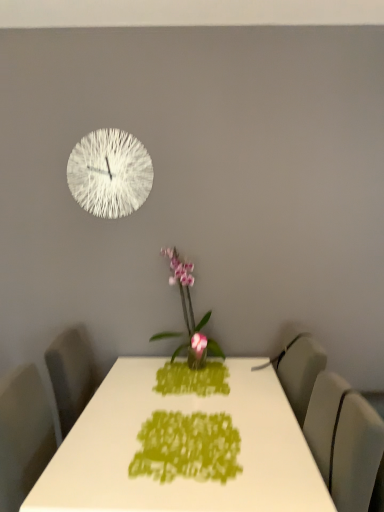
I want to click on empty space that is to the right of green fabric placemat at center, so click(278, 442).